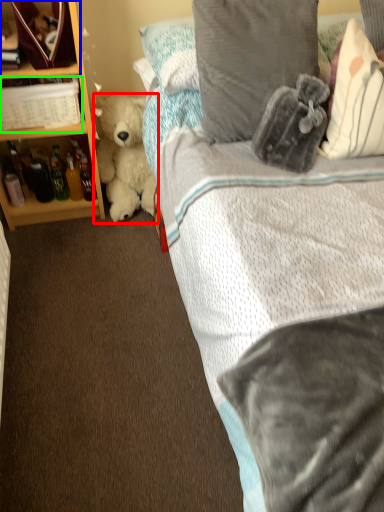
Question: Based on their relative distances, which object is farther from teddy bear (highlighted by a red box)? Choose from shelf (highlighted by a blue box) and book (highlighted by a green box).

Choices:
 (A) shelf
 (B) book

Answer: (A)